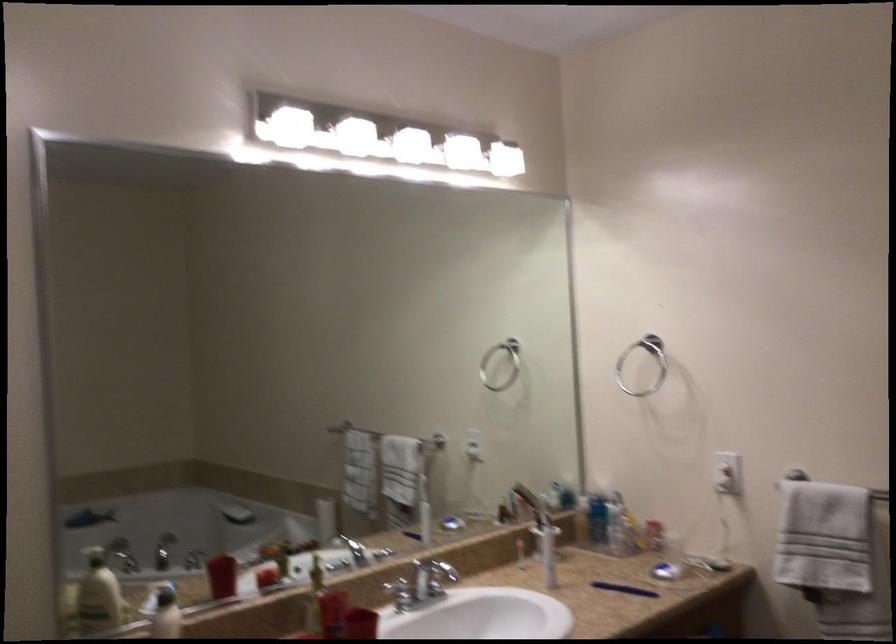
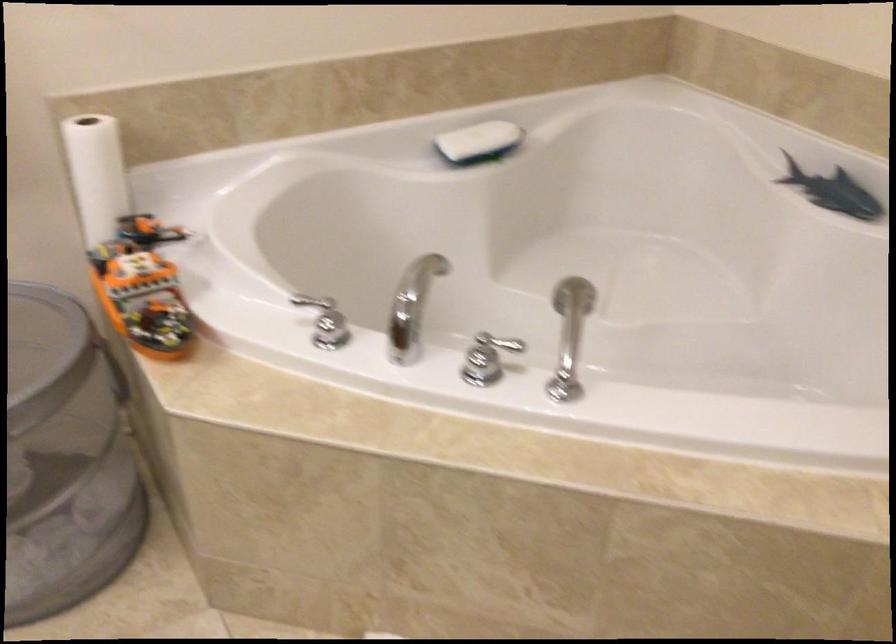
How did the camera likely rotate?

The rotation direction of the camera is right-down.